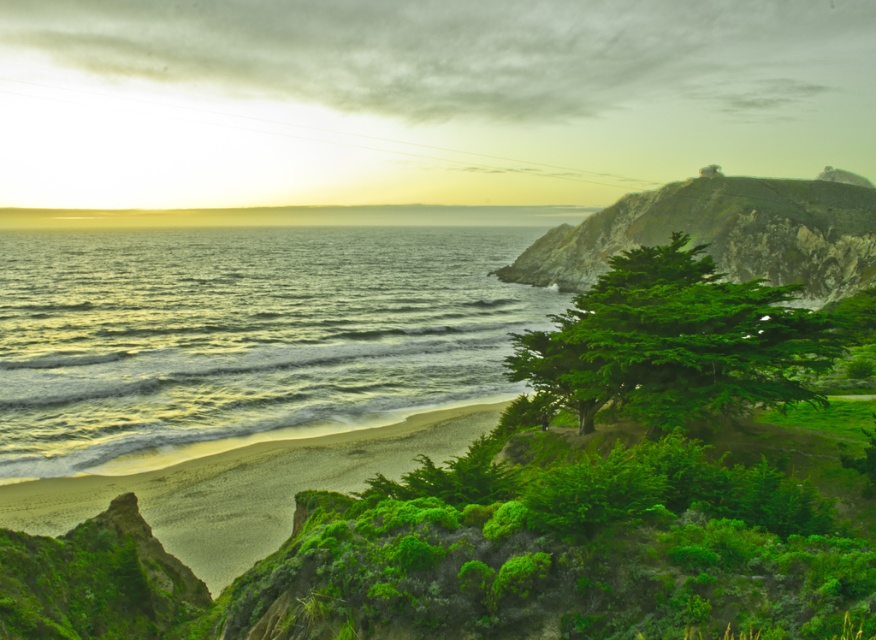
Question: Can you confirm if green leafy tree at center is thinner than green mossy cliff at upper right?

Choices:
 (A) no
 (B) yes

Answer: (B)

Question: Does greenish-blue water at lower left appear on the right side of green leafy tree at center?

Choices:
 (A) yes
 (B) no

Answer: (B)

Question: In this image, where is greenish-blue water at lower left located relative to green leafy tree at center?

Choices:
 (A) left
 (B) right

Answer: (A)

Question: Which of the following is the closest to the observer?

Choices:
 (A) green mossy cliff at upper right
 (B) green leafy tree at center
 (C) greenish-blue water at lower left

Answer: (B)

Question: Among these objects, which one is nearest to the camera?

Choices:
 (A) greenish-blue water at lower left
 (B) green mossy cliff at upper right

Answer: (B)

Question: Which object is closer to the camera taking this photo?

Choices:
 (A) greenish-blue water at lower left
 (B) green mossy cliff at upper right
 (C) green leafy tree at center

Answer: (C)